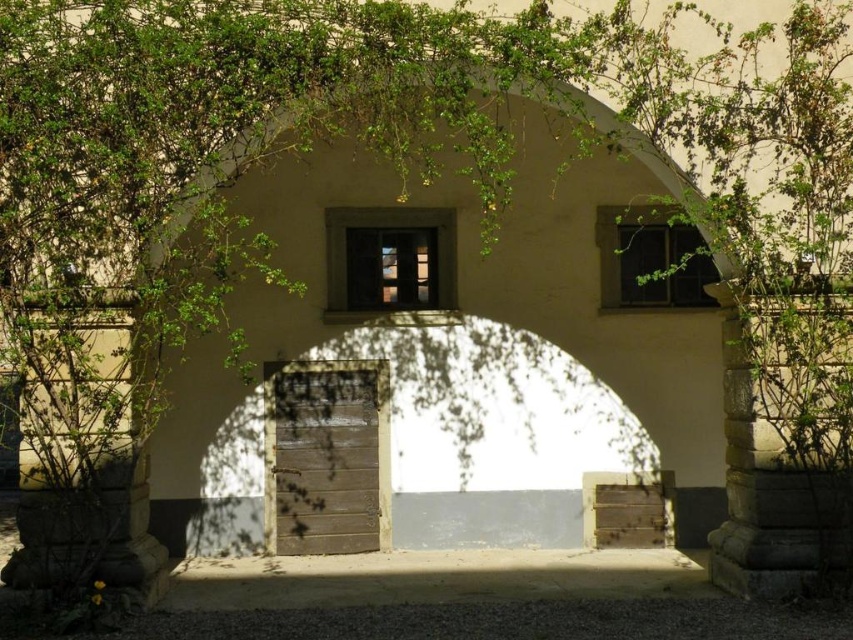
Question: Is matte glass window at center further to the viewer compared to matte glass window at upper right?

Choices:
 (A) no
 (B) yes

Answer: (A)

Question: Which point appears closest to the camera in this image?

Choices:
 (A) (390, 216)
 (B) (606, 253)

Answer: (A)

Question: Among these objects, which one is nearest to the camera?

Choices:
 (A) matte glass window at upper right
 (B) matte glass window at center

Answer: (B)

Question: Is matte glass window at center thinner than matte glass window at upper right?

Choices:
 (A) no
 (B) yes

Answer: (B)

Question: Which object appears closest to the camera in this image?

Choices:
 (A) matte glass window at center
 (B) matte glass window at upper right

Answer: (A)

Question: Does matte glass window at center appear on the left side of matte glass window at upper right?

Choices:
 (A) no
 (B) yes

Answer: (B)